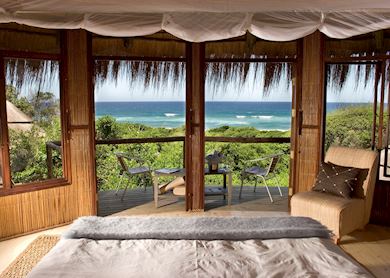
Locate an element on the screen. This screenshot has width=390, height=278. comforter is located at coordinates (170, 257).